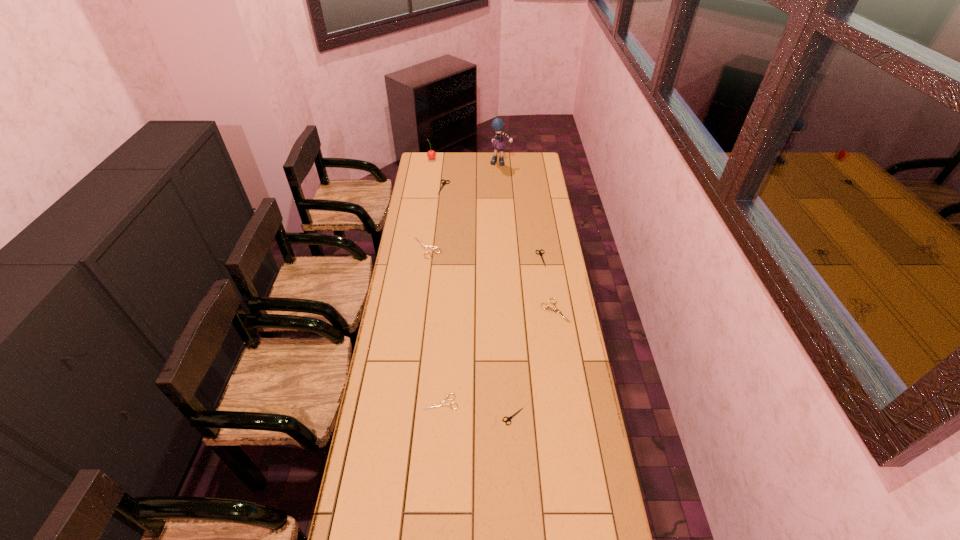
Where is `the tallest object`? This screenshot has width=960, height=540. the tallest object is located at coordinates (497, 124).

The height and width of the screenshot is (540, 960). I want to click on rag doll, so click(497, 124).

At what (x,y) coordinates should I click in order to perform the action: click on red cherry. Please return your answer as a coordinate pair (x, y). The image size is (960, 540). Looking at the image, I should click on (431, 154).

The height and width of the screenshot is (540, 960). I want to click on the second tallest object, so click(431, 154).

Where is `the sixth nearest object`? The image size is (960, 540). the sixth nearest object is located at coordinates (443, 183).

Find the location of `the biggest black shears`. the biggest black shears is located at coordinates (443, 183).

The width and height of the screenshot is (960, 540). What are the coordinates of `the biggest beige shears` in the screenshot? It's located at (433, 248).

Locate an element on the screen. the second nearest black shears is located at coordinates (540, 253).

Identify the location of the rightmost black shears. This screenshot has width=960, height=540. point(540,253).

Find the location of a particular element. The image size is (960, 540). the rightmost beige shears is located at coordinates (548, 308).